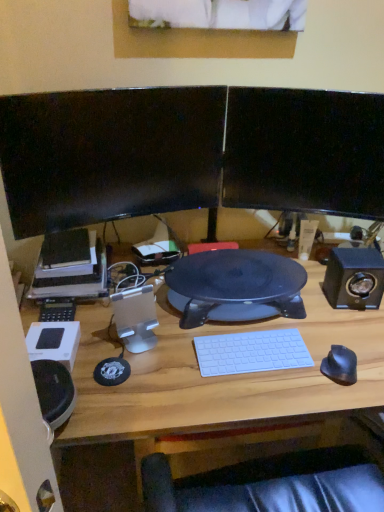
In order to click on vacant space that's between black matte speaker at right, the first speaker from the right, and black plastic desk at center in this screenshot , I will do `click(322, 298)`.